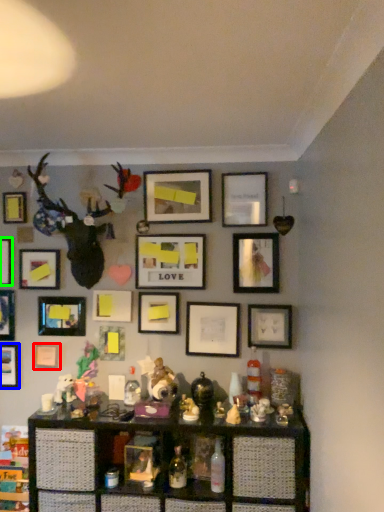
Question: Considering the real-world distances, which object is farthest from picture frame (highlighted by a red box)? picture frame (highlighted by a blue box) or picture frame (highlighted by a green box)?

Choices:
 (A) picture frame
 (B) picture frame

Answer: (B)